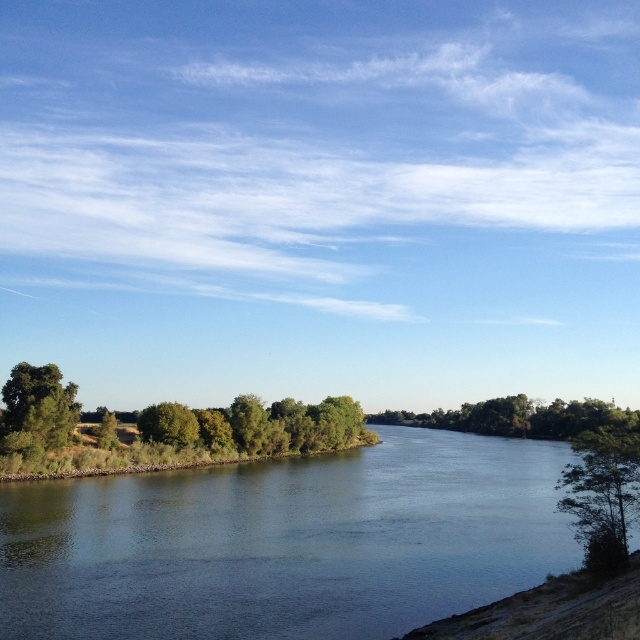
Question: Does green leafy tree at lower left have a lesser width compared to green leafy tree at center?

Choices:
 (A) no
 (B) yes

Answer: (A)

Question: Does dark blue water at center appear over green leafy tree at lower right?

Choices:
 (A) no
 (B) yes

Answer: (A)

Question: Where is green leafy tree at lower left located in relation to green leafy tree at center in the image?

Choices:
 (A) left
 (B) right

Answer: (A)

Question: Which point is farther to the camera?

Choices:
 (A) green leafy tree at lower left
 (B) green leafy tree at center
 (C) dark blue water at center

Answer: (B)

Question: Considering the real-world distances, which object is closest to the green leafy tree at lower right?

Choices:
 (A) green leafy tree at lower left
 (B) green leafy tree at center

Answer: (A)

Question: Which point is farther from the camera taking this photo?

Choices:
 (A) (618, 449)
 (B) (204, 486)
 (C) (148, 412)

Answer: (C)